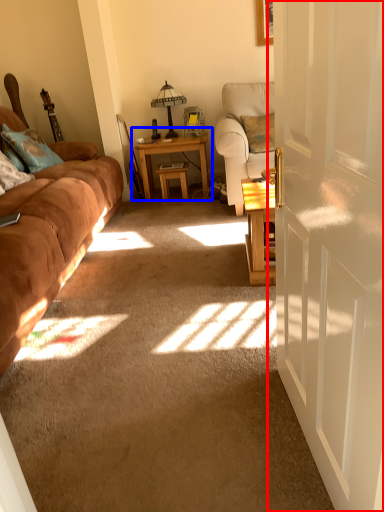
Question: Which of the following is the farthest to the observer, door (highlighted by a red box) or table (highlighted by a blue box)?

Choices:
 (A) door
 (B) table

Answer: (B)